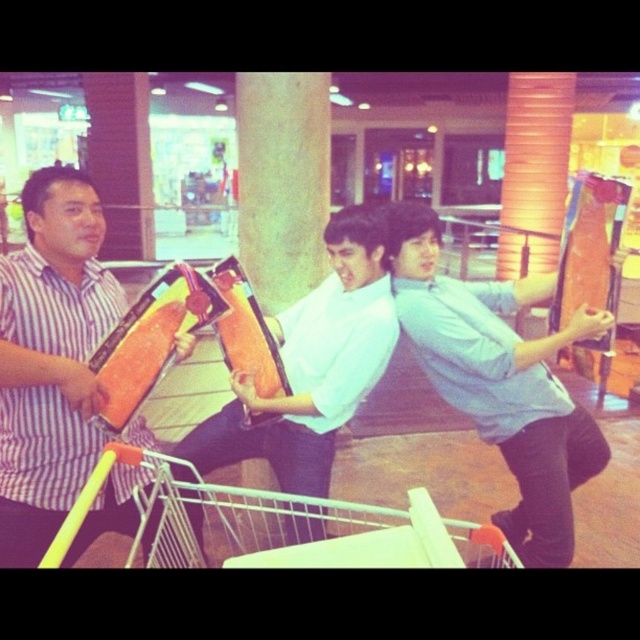
You are a photographer setting up a shoot in a mall. You need to arrange two models wearing the matte striped shirt at left and light blue shirt at center so that their heights are visually balanced in the photo. Which model should you place closer to the camera?

The matte striped shirt at left has a lesser height compared to light blue shirt at center. To balance their heights visually, place the matte striped shirt at left closer to the camera since being closer can make them appear taller in the photo.

Based on the scene description, where is the matte striped shirt at left positioned in the image? Provide coordinates as a point in the format of point X, Y.

The matte striped shirt at left is positioned at point (x=51, y=358).